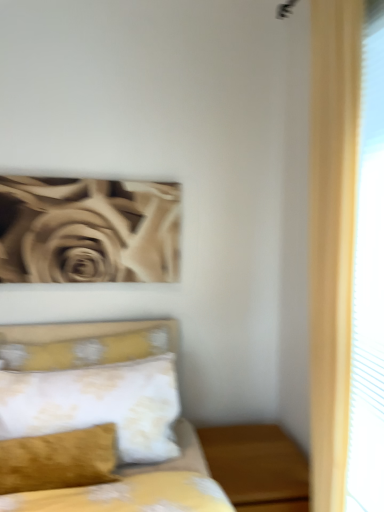
Question: Is floral-patterned fabric pillow at center-left oriented towards yellow floral fabric bed at lower left?

Choices:
 (A) no
 (B) yes

Answer: (B)

Question: Is floral-patterned fabric pillow at center-left bigger than yellow floral fabric bed at lower left?

Choices:
 (A) no
 (B) yes

Answer: (A)

Question: Can you confirm if floral-patterned fabric pillow at center-left is smaller than yellow floral fabric bed at lower left?

Choices:
 (A) no
 (B) yes

Answer: (B)

Question: Is floral-patterned fabric pillow at center-left shorter than yellow floral fabric bed at lower left?

Choices:
 (A) yes
 (B) no

Answer: (A)

Question: Is floral-patterned fabric pillow at center-left not near yellow floral fabric bed at lower left?

Choices:
 (A) yes
 (B) no

Answer: (B)

Question: Considering the positions of floral-patterned fabric pillow at center-left and wooden nightstand at lower right in the image, is floral-patterned fabric pillow at center-left taller or shorter than wooden nightstand at lower right?

Choices:
 (A) short
 (B) tall

Answer: (A)

Question: Relative to wooden nightstand at lower right, is floral-patterned fabric pillow at center-left in front or behind?

Choices:
 (A) behind
 (B) front

Answer: (A)

Question: Is point (89, 378) closer or farther from the camera than point (244, 461)?

Choices:
 (A) closer
 (B) farther

Answer: (A)

Question: From the image's perspective, is floral-patterned fabric pillow at center-left positioned above or below wooden nightstand at lower right?

Choices:
 (A) above
 (B) below

Answer: (A)

Question: Is wooden nightstand at lower right situated inside floral-patterned fabric pillow at center-left or outside?

Choices:
 (A) outside
 (B) inside

Answer: (A)

Question: Considering the relative positions of wooden nightstand at lower right and floral-patterned fabric pillow at center-left in the image provided, is wooden nightstand at lower right to the left or to the right of floral-patterned fabric pillow at center-left?

Choices:
 (A) right
 (B) left

Answer: (A)

Question: From a real-world perspective, is wooden nightstand at lower right positioned above or below floral-patterned fabric pillow at center-left?

Choices:
 (A) below
 (B) above

Answer: (A)

Question: In the image, is wooden nightstand at lower right positioned in front of or behind floral-patterned fabric pillow at center-left?

Choices:
 (A) front
 (B) behind

Answer: (A)

Question: Is yellow floral fabric bed at lower left situated inside floral-patterned fabric pillow at center-left or outside?

Choices:
 (A) inside
 (B) outside

Answer: (B)

Question: Considering the positions of point (120, 415) and point (11, 434), is point (120, 415) closer or farther from the camera than point (11, 434)?

Choices:
 (A) closer
 (B) farther

Answer: (B)